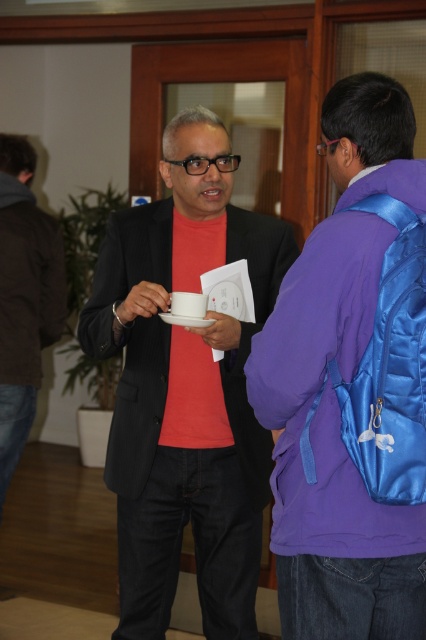
Can you confirm if matte black suit at center is positioned below brown leather jacket at left?

Yes, matte black suit at center is below brown leather jacket at left.

Is matte black suit at center smaller than brown leather jacket at left?

Incorrect, matte black suit at center is not smaller in size than brown leather jacket at left.

I want to click on matte black suit at center, so click(x=186, y=388).

Which is behind, point (60, 324) or point (54, 262)?

Point (60, 324)

Does brown leather jacket at left appear over black matte jacket at left?

Actually, brown leather jacket at left is below black matte jacket at left.

Where is `brown leather jacket at left`? The width and height of the screenshot is (426, 640). brown leather jacket at left is located at coordinates (23, 298).

Identify the location of brown leather jacket at left. Image resolution: width=426 pixels, height=640 pixels. (23, 298).

Is matte black suit at center thinner than black matte jacket at left?

Incorrect, matte black suit at center's width is not less than black matte jacket at left's.

This screenshot has height=640, width=426. What do you see at coordinates (186, 388) in the screenshot?
I see `matte black suit at center` at bounding box center [186, 388].

Locate an element on the screen. This screenshot has width=426, height=640. matte black suit at center is located at coordinates (186, 388).